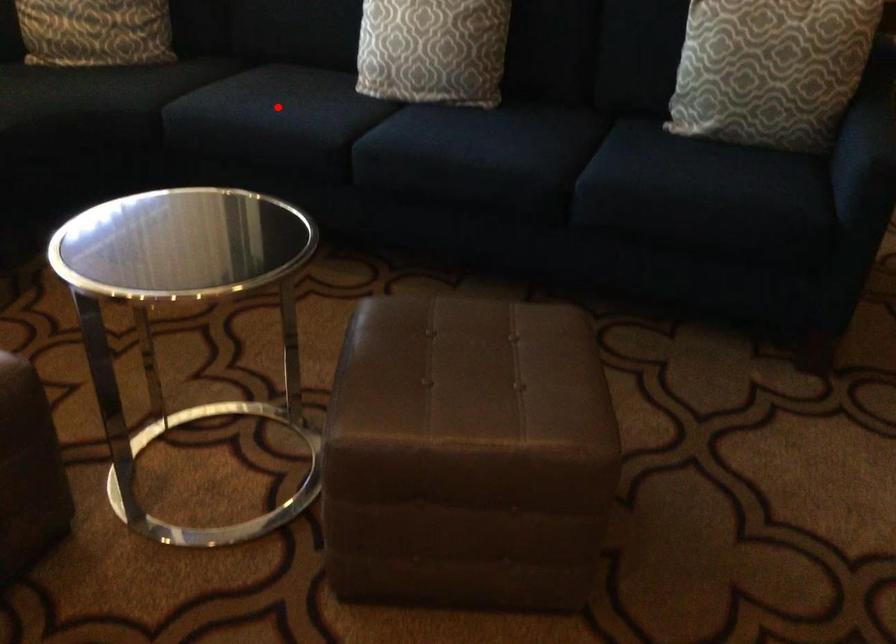
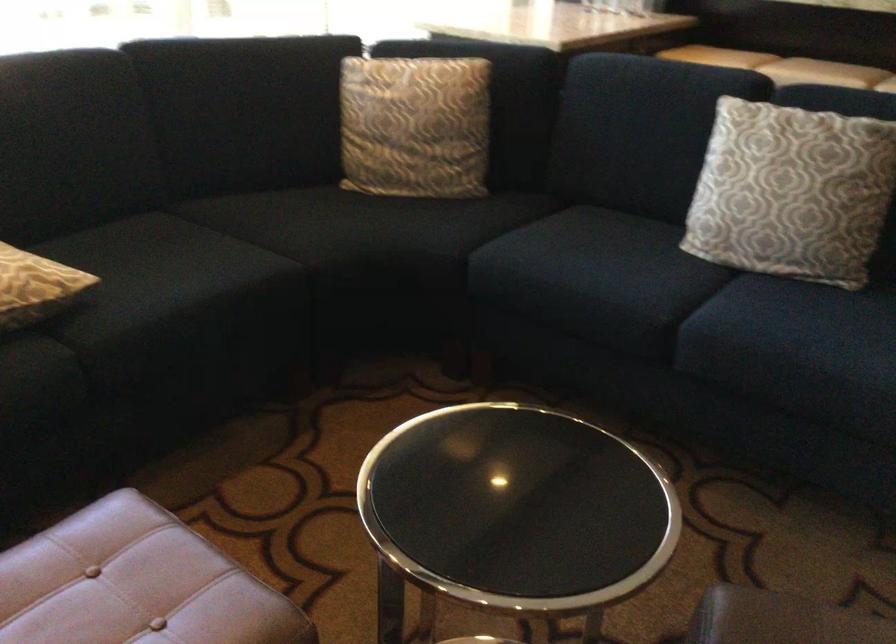
Question: I am providing you with two images of the same scene from different viewpoints. In image1, a red point is highlighted. Considering the same 3D point in image2, which of the following is correct?

Choices:
 (A) It is closer
 (B) It is farther

Answer: (A)